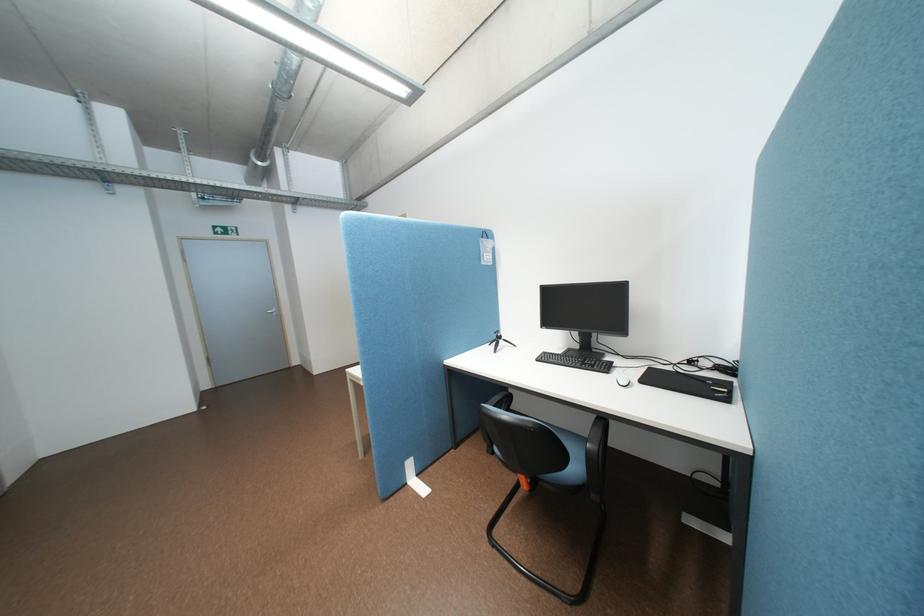
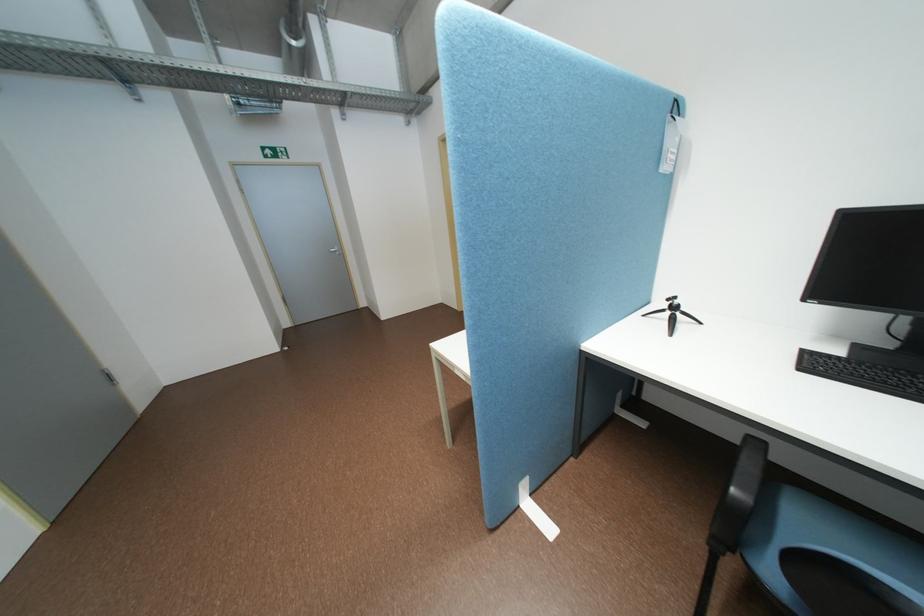
What movement of the cameraman would produce the second image?

The cameraman moved toward left, forward.